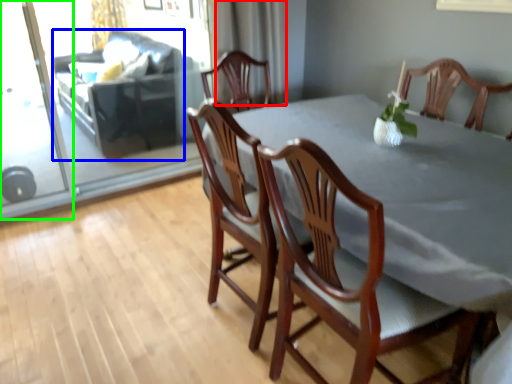
Question: Considering the real-world distances, which object is closest to curtain (highlighted by a red box)? couch (highlighted by a blue box) or screen door (highlighted by a green box).

Choices:
 (A) couch
 (B) screen door

Answer: (A)